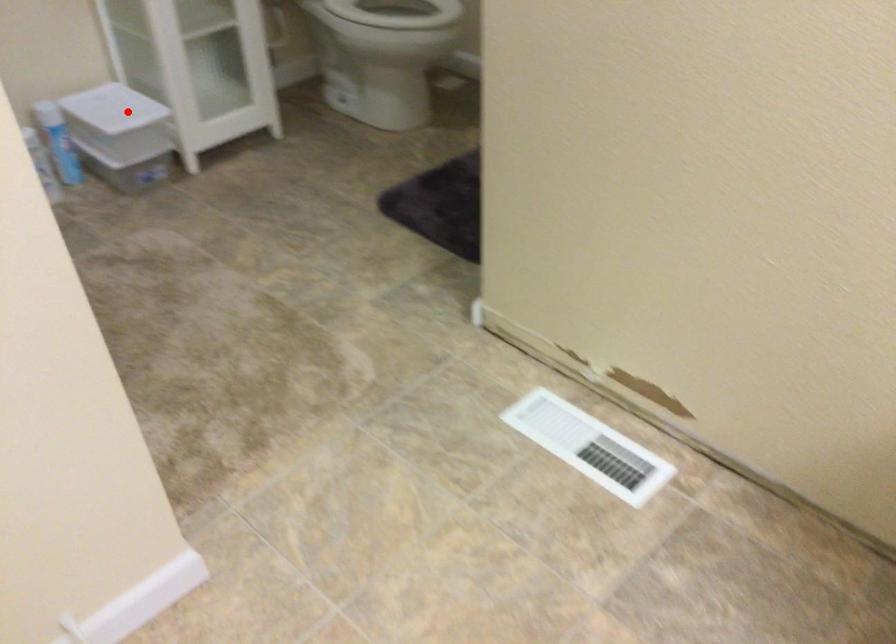
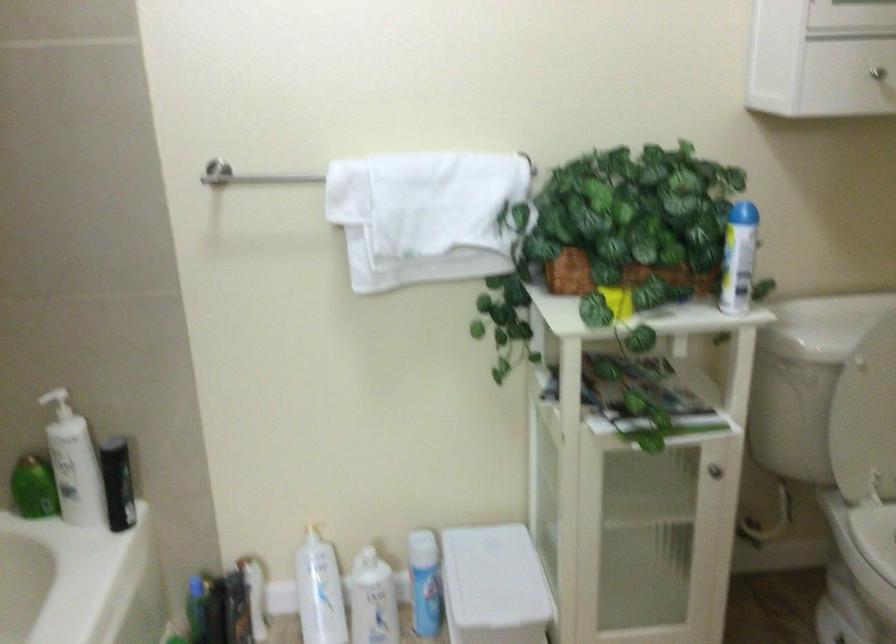
Question: I am providing you with two images of the same scene from different viewpoints. A red point is shown in image1. For the corresponding object point in image2, is it positioned nearer or farther from the camera?

Choices:
 (A) Nearer
 (B) Farther

Answer: (A)